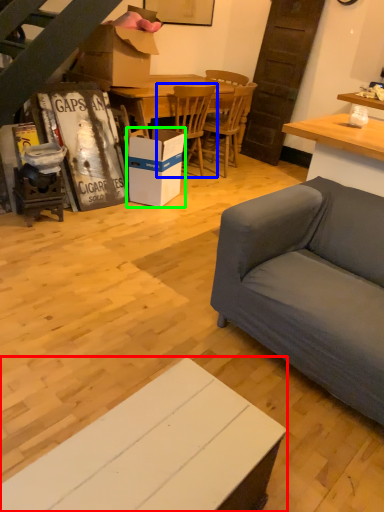
Question: Considering the real-world distances, which object is closest to cabinetry (highlighted by a red box)? chair (highlighted by a blue box) or box (highlighted by a green box).

Choices:
 (A) chair
 (B) box

Answer: (B)